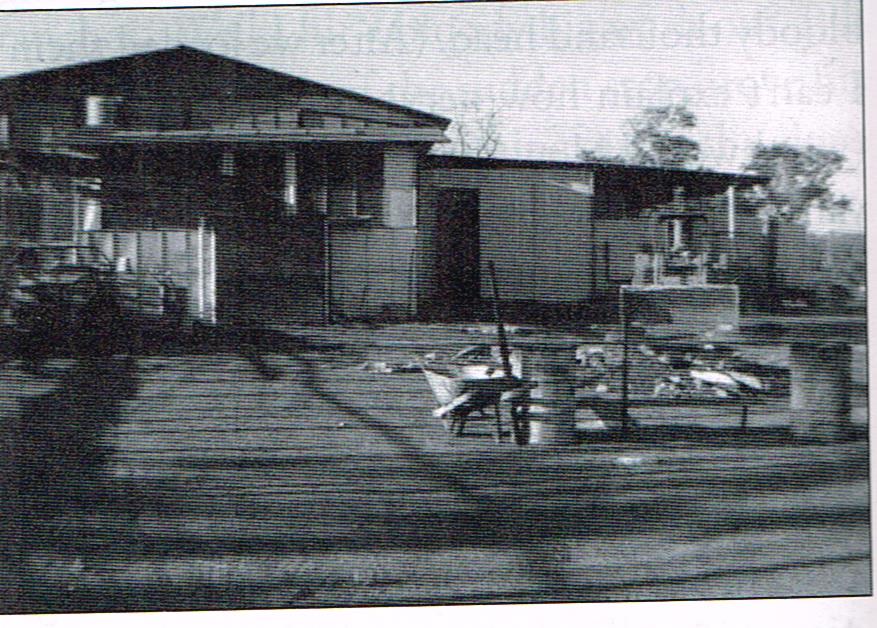
This screenshot has width=877, height=628. Identify the location of stone floor. (291, 441).